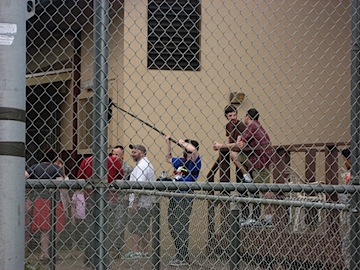
This screenshot has width=360, height=270. Identify the location of dark wooden railing. (285, 166), (295, 144), (226, 174).